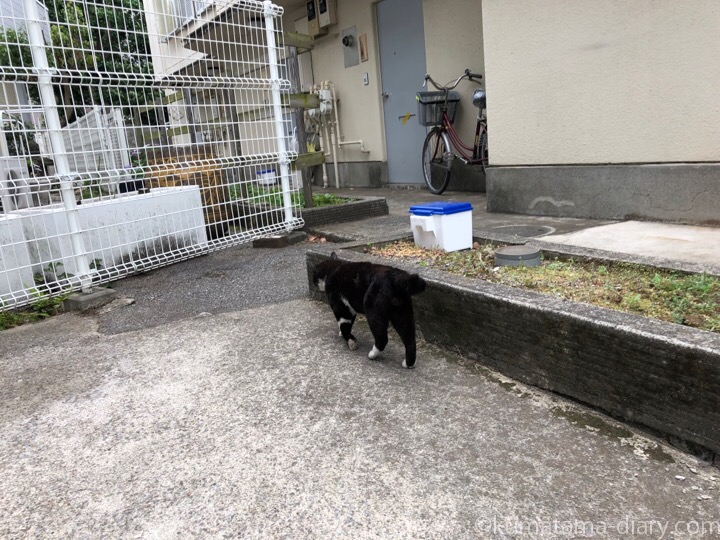
Image resolution: width=720 pixels, height=540 pixels. What are the coordinates of `door handle` in the screenshot? It's located at (384, 94).